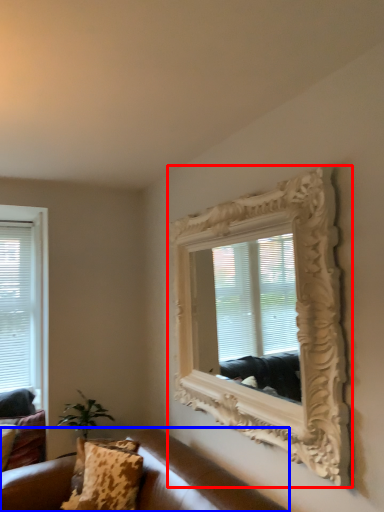
Question: Which of the following is the closest to the observer, picture frame (highlighted by a red box) or studio couch (highlighted by a blue box)?

Choices:
 (A) picture frame
 (B) studio couch

Answer: (B)